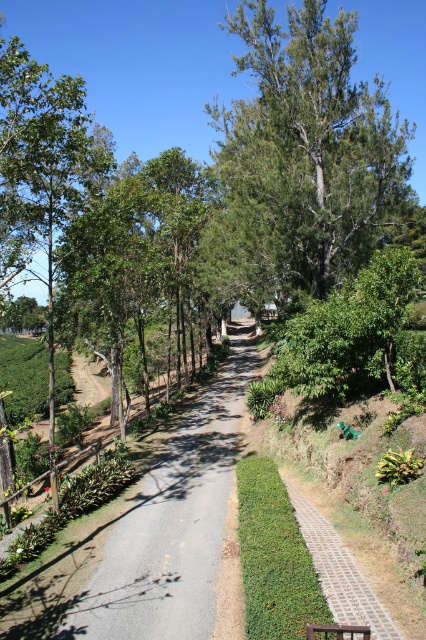
Which is behind, point (109, 582) or point (316, 570)?

The point (109, 582) is behind.

Where is `gray gravel trail at center`? The image size is (426, 640). gray gravel trail at center is located at coordinates (173, 524).

Can you confirm if green leafy tree at center is positioned above paved stone trail at center?

Indeed, green leafy tree at center is positioned over paved stone trail at center.

Does green leafy tree at center appear under paved stone trail at center?

Actually, green leafy tree at center is above paved stone trail at center.

Between point (367, 209) and point (362, 625), which one is positioned in front?

Point (362, 625)

Locate an element on the screen. The image size is (426, 640). green leafy tree at center is located at coordinates (302, 157).

Is the position of green leafy tree at center more distant than that of brown wooden bench at center?

Yes, green leafy tree at center is behind brown wooden bench at center.

From the picture: Is green leafy tree at center wider than brown wooden bench at center?

Correct, the width of green leafy tree at center exceeds that of brown wooden bench at center.

Does point (273, 193) come closer to viewer compared to point (317, 625)?

No, it is behind (317, 625).

You are a GUI agent. You are given a task and a screenshot of the screen. Output one action in this format:
    pyautogui.click(x=<x>, y=<y>)
    Task: Click on the green leafy tree at center
    The width and height of the screenshot is (426, 640).
    Given the screenshot: What is the action you would take?
    pyautogui.click(x=302, y=157)